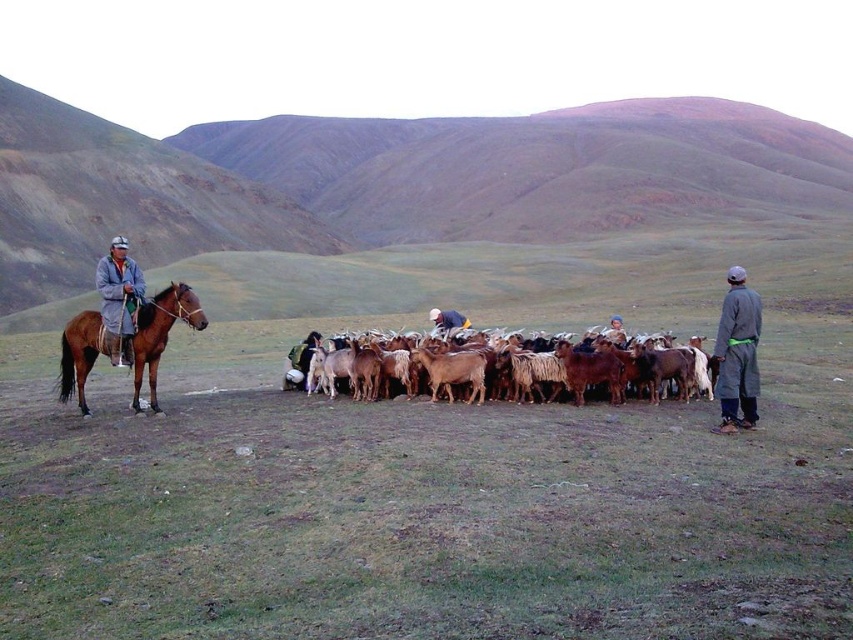
You are a hiker trying to cross the green grassland at center and the white woolen sweater at center. Which path is wider?

The green grassland at center is wider than the white woolen sweater at center, so the green grassland at center is the wider path.

Looking at this image, you are a hiker who wants to cross the green grassland at center. However, you have a gray woolen jacket at left that you might need to wear. If you wear the jacket, will it still be visible above the grassland?

The green grassland at center is taller than the gray woolen jacket at left, so if you wear the jacket, it will not be visible above the grassland because the grass is taller than the jacket.